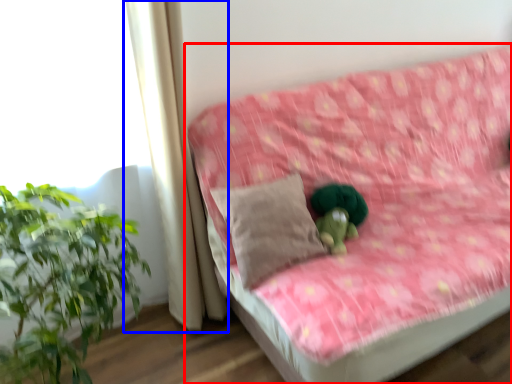
Question: Which of the following is the closest to the observer, studio couch (highlighted by a red box) or curtain (highlighted by a blue box)?

Choices:
 (A) studio couch
 (B) curtain

Answer: (A)